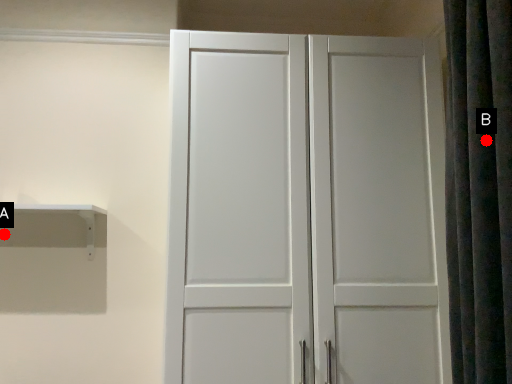
Question: Two points are circled on the image, labeled by A and B beside each circle. Which point appears closest to the camera in this image?

Choices:
 (A) A is closer
 (B) B is closer

Answer: (B)